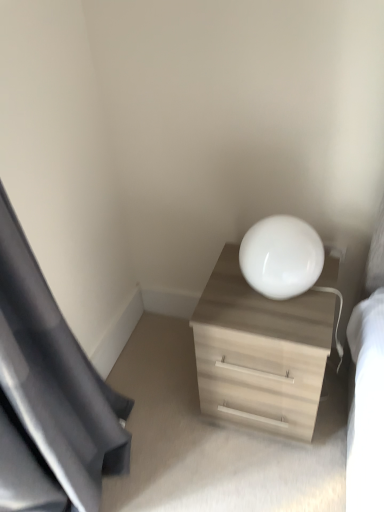
At what (x,y) coordinates should I click in order to perform the action: click on free spot below white glossy lampshade at upper right (from a real-world perspective). Please return your answer as a coordinate pair (x, y). This screenshot has width=384, height=512. Looking at the image, I should click on (277, 300).